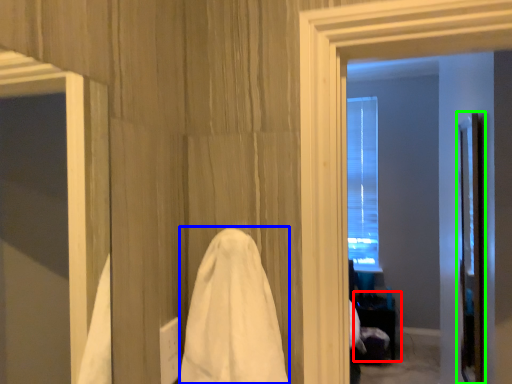
Question: Which is nearer to the table (highlighted by a red box)? bath towel (highlighted by a blue box) or screen door (highlighted by a green box).

Choices:
 (A) bath towel
 (B) screen door

Answer: (B)